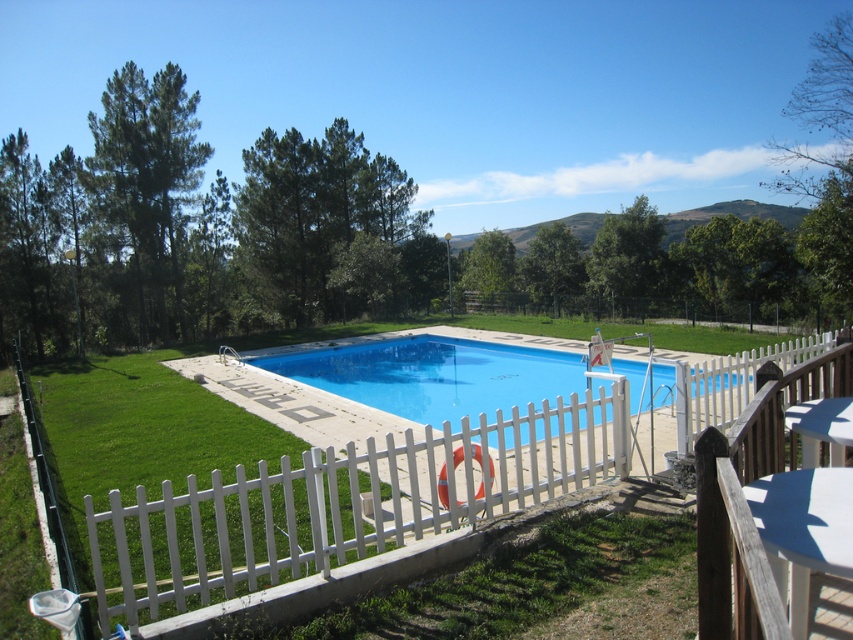
You are standing at the center of the image and want to locate the white picket fence at center. What is its exact position in the coordinate system?

The white picket fence at center is located at point [349,500].

You are planning to install a new bench in the pool area. The bench requires a space that is at least 15 meters away from the blue smooth pool at center for safety. Can you place the bench near the white picket fence at center?

The white picket fence at center is 16.17 meters away from the blue smooth pool at center, which meets the safety requirement of 15 meters. Therefore, you can place the bench near the white picket fence at center.

You are designing a new layout for a garden and want to place a small flower bed between the white picket fence at center and the blue smooth pool at center. Given their sizes, which object should the flower bed be closer to?

The flower bed should be placed closer to the white picket fence at center because it occupies less space than the blue smooth pool at center, allowing more room for the flower bed near the larger pool area.